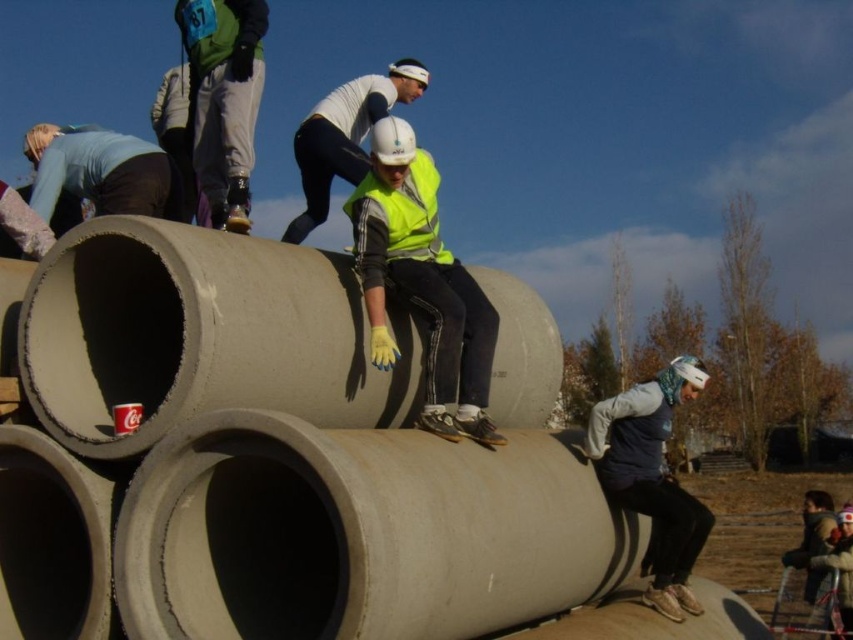
You are an observer looking at the scene. You see the dark gray fabric beanie at lower right and the green fabric bib at upper left. Which object is located to the right of the other?

The dark gray fabric beanie at lower right is positioned on the right side of green fabric bib at upper left.